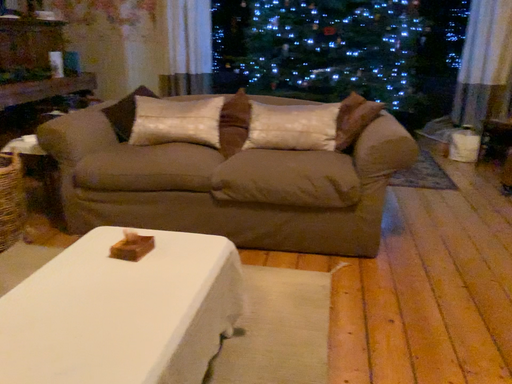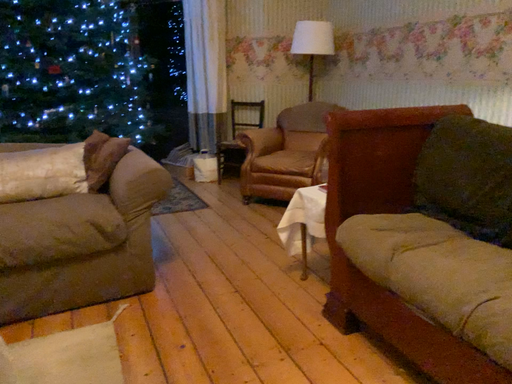
Question: Which way did the camera rotate in the video?

Choices:
 (A) rotated downward
 (B) rotated upward

Answer: (B)